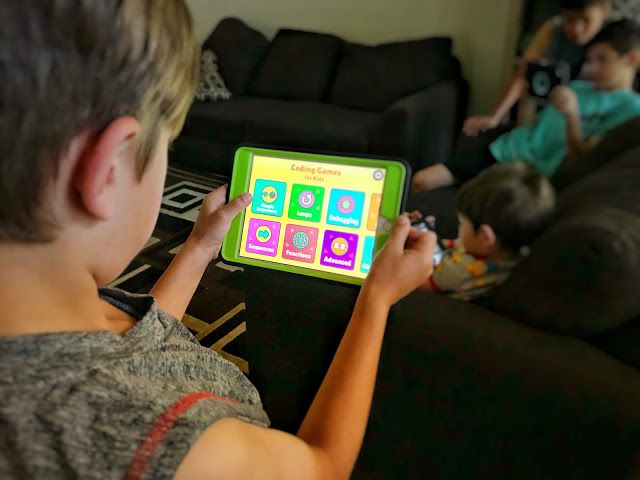
You are a GUI agent. You are given a task and a screenshot of the screen. Output one action in this format:
    pyautogui.click(x=<x>, y=<y>)
    Task: Click on the shadow of sofa
    This screenshot has height=480, width=640.
    Given the screenshot: What is the action you would take?
    pyautogui.click(x=482, y=87)